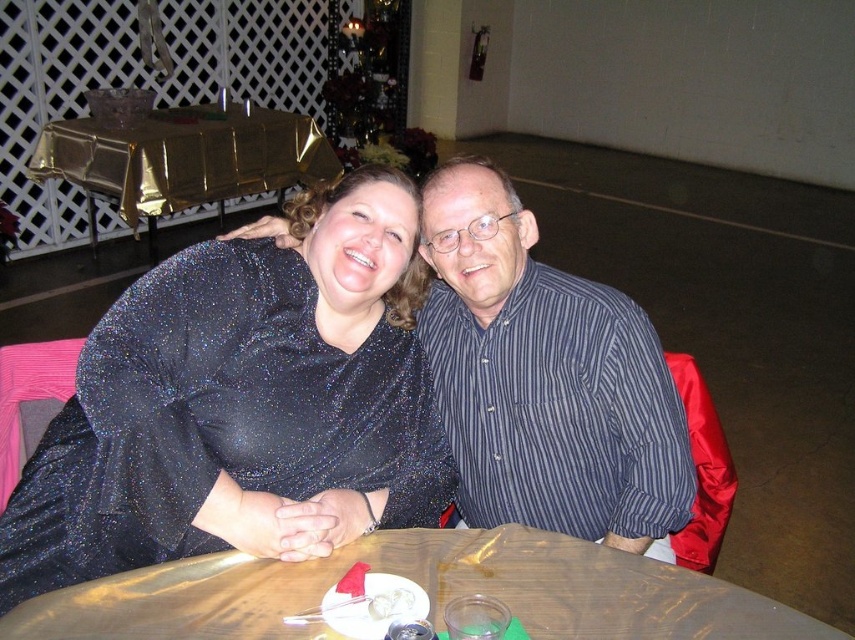
You are planning to place a small decorative item on the gold foil table at upper left and the white creamy dessert at table. Based on their sizes, which surface can accommodate the item more comfortably?

The gold foil table at upper left is larger in size than the white creamy dessert at table, so it can accommodate the small decorative item more comfortably.

You are at a social event and want to place a small gift on the table between the gold foil table at upper left and the white creamy dessert at table. Where should you place it?

Place the small gift to the right of the gold foil table at upper left, since the gold foil table at upper left is located to the left of the white creamy dessert at table, creating space between them.

You are standing in front of the table and want to reach the point at coordinates (600,460). Can you comfortably reach it without moving your feet?

The point at coordinates (600,460) is 1.49 meters away from the viewer. Since the average comfortable reaching distance for an adult is about 1.2 to 1.5 meters, you can comfortably reach it without moving your feet.